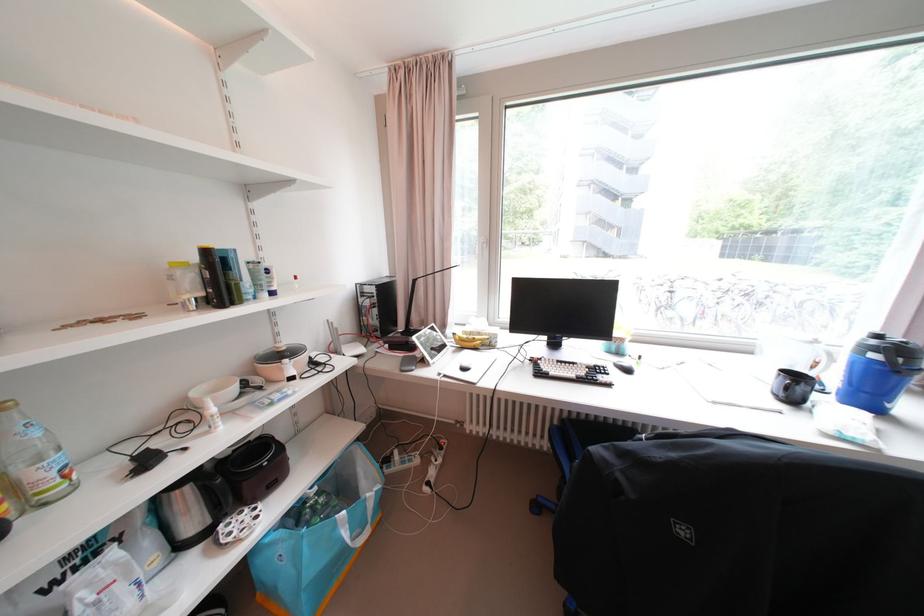
This screenshot has width=924, height=616. Describe the element at coordinates (913, 359) in the screenshot. I see `the kettle handle` at that location.